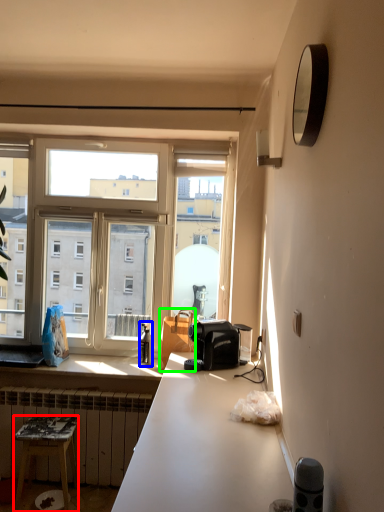
Question: Estimate the real-world distances between objects in this image. Which object is closer to stool (highlighted by a red box), bottle (highlighted by a blue box) or handbag (highlighted by a green box)?

Choices:
 (A) bottle
 (B) handbag

Answer: (A)